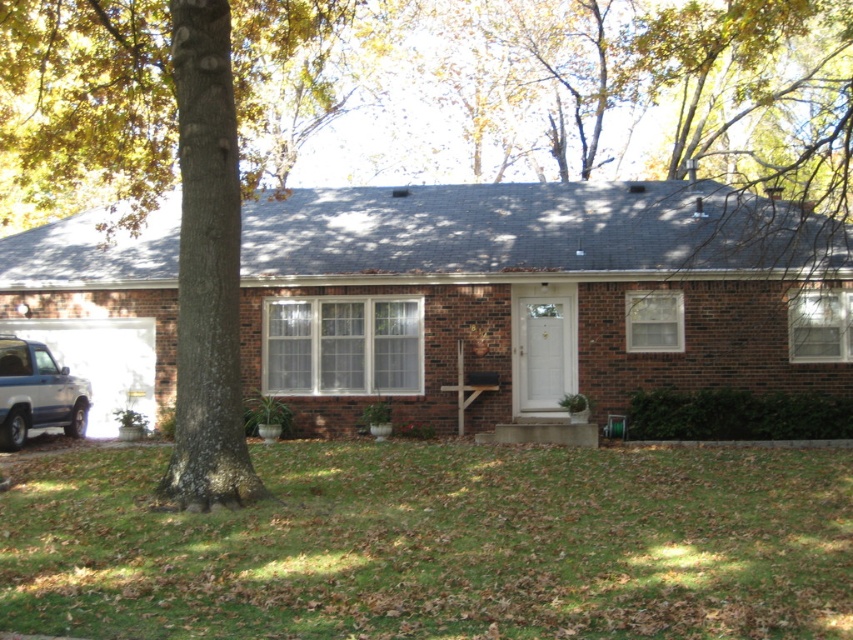
You are planning to park your car, which is 15 feet long, in the driveway between the green grass at lower center and the satin silver suv at lower left. Is there enough space to park your car without overlapping either of them?

The distance between the green grass at lower center and the satin silver suv at lower left is 20.98 feet. Since your car is 15 feet long, there is enough space to park without overlapping either object.

Looking at this image, you are standing in front of the house and want to know how far the point at coordinates (x=505, y=461) is from you. Can you determine the distance?

The point at coordinates (x=505, y=461) is 42.56 feet away from the viewer.

You are standing at the front door of the residential brick house. Looking towards the direction of the point marked at coordinates (438,545), what do you see there?

At point (438,545), there is green grass at lower center.